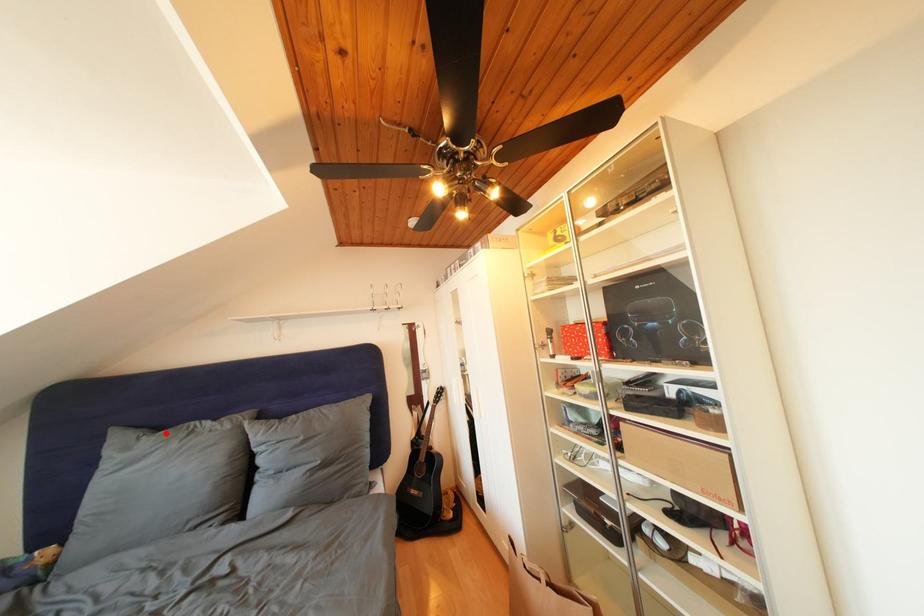
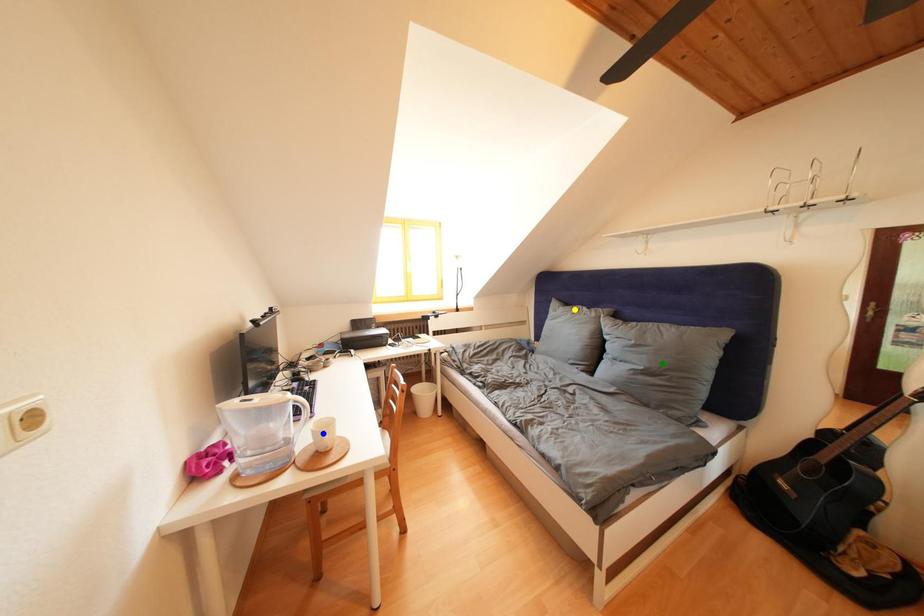
Question: I am providing you with two images of the same scene from different viewpoints. A red point is marked on the first image. You are given multiple points on the second image. Which spot in image 2 lines up with the point in image 1?

Choices:
 (A) yellow point
 (B) blue point
 (C) green point

Answer: (A)